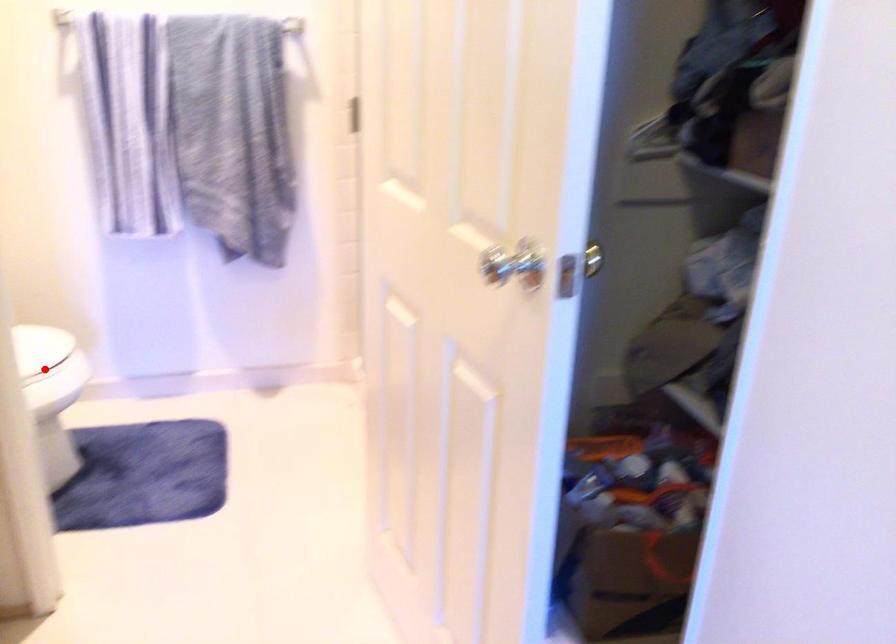
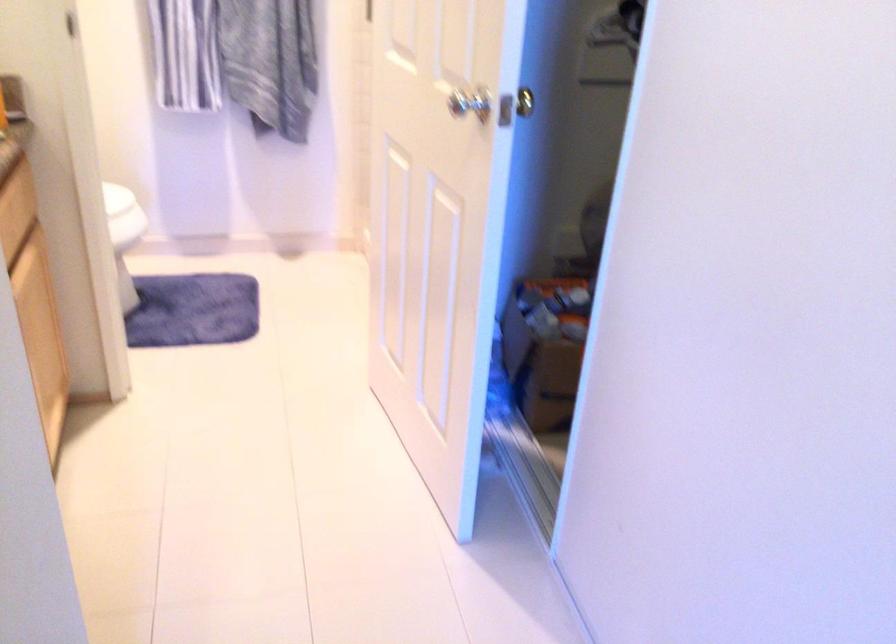
Question: I am providing you with two images of the same scene from different viewpoints. A red point is marked on the first image. Is the red point's position out of view in image 2?

Choices:
 (A) Yes
 (B) No

Answer: (A)